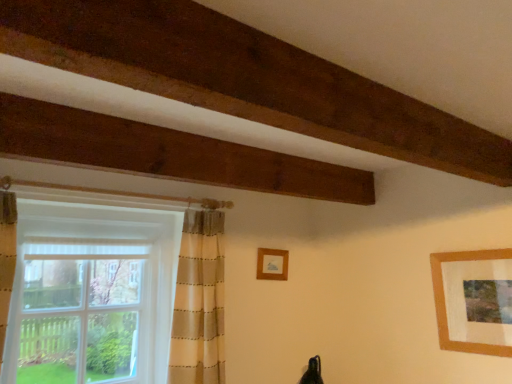
Question: Do you think wooden picture frame at upper right, the 2th picture frame when ordered from left to right, is within white sheer curtain at left, or outside of it?

Choices:
 (A) inside
 (B) outside

Answer: (B)

Question: From a real-world perspective, is wooden picture frame at upper right, which is the 2th picture frame in back-to-front order, physically located above or below white sheer curtain at left?

Choices:
 (A) above
 (B) below

Answer: (B)

Question: Estimate the real-world distances between objects in this image. Which object is farther from the wooden frame at center, which ranks as the 2th picture frame in front-to-back order?

Choices:
 (A) white sheer curtain at left
 (B) wooden picture frame at upper right, which is the 2th picture frame in back-to-front order

Answer: (B)

Question: Which is farther from the white sheer curtain at left?

Choices:
 (A) wooden picture frame at upper right, which is the 2th picture frame in back-to-front order
 (B) wooden frame at center, which is counted as the 2th picture frame, starting from the right

Answer: (A)